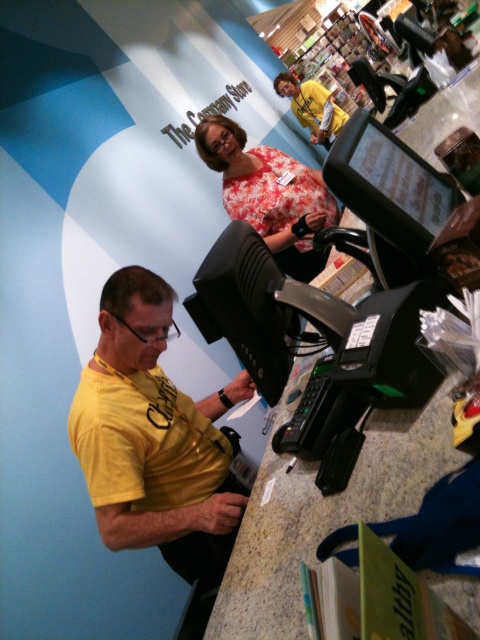
Looking at this image, you are a customer at The Company Store and want to purchase the floral fabric blouse at center. Where on the counter should you place your payment card for the cashier to process it easily?

The floral fabric blouse at center is located at point (269,195), so you should place your payment card near that location for the cashier to process it easily.

You are a customer in The Company Store and you see two points on the counter where you can place your items. Which point is closer to you, point (x=266, y=160) or point (x=336, y=132)?

Point (x=266, y=160) is closer to the viewer than point (x=336, y=132).